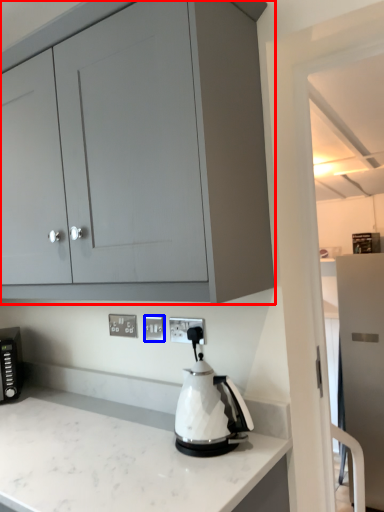
Question: Which point is closer to the camera, cabinetry (highlighted by a red box) or electric outlet (highlighted by a blue box)?

Choices:
 (A) cabinetry
 (B) electric outlet

Answer: (A)